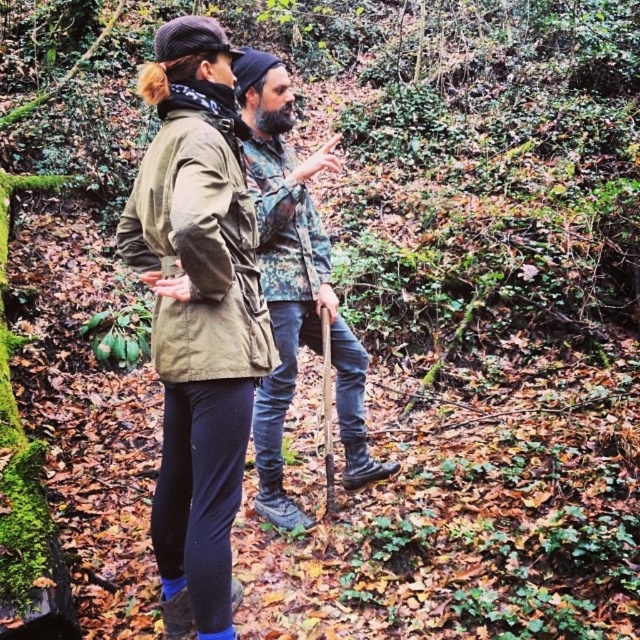
Question: Where is matte khaki jacket at center located in relation to camouflage fabric shirt at center in the image?

Choices:
 (A) right
 (B) left

Answer: (B)

Question: Can you confirm if matte khaki jacket at center is wider than camouflage fabric shirt at center?

Choices:
 (A) no
 (B) yes

Answer: (A)

Question: Which point is farther to the camera?

Choices:
 (A) (291, 259)
 (B) (144, 72)

Answer: (B)

Question: Among these objects, which one is nearest to the camera?

Choices:
 (A) matte khaki jacket at center
 (B) camouflage fabric shirt at center

Answer: (A)

Question: Which object is farther from the camera taking this photo?

Choices:
 (A) camouflage fabric shirt at center
 (B) matte khaki jacket at center

Answer: (A)

Question: Is matte khaki jacket at center positioned at the back of camouflage fabric shirt at center?

Choices:
 (A) no
 (B) yes

Answer: (A)